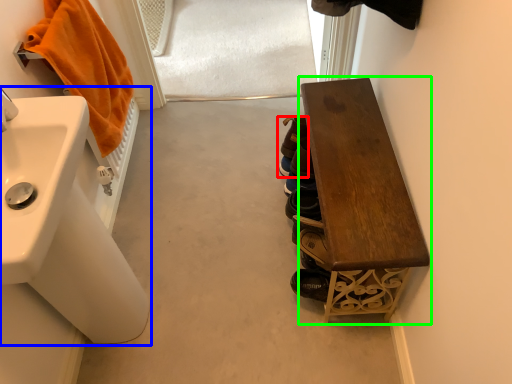
Question: Based on their relative distances, which object is nearer to footwear (highlighted by a red box)? Choose from sink (highlighted by a blue box) and furniture (highlighted by a green box).

Choices:
 (A) sink
 (B) furniture

Answer: (B)